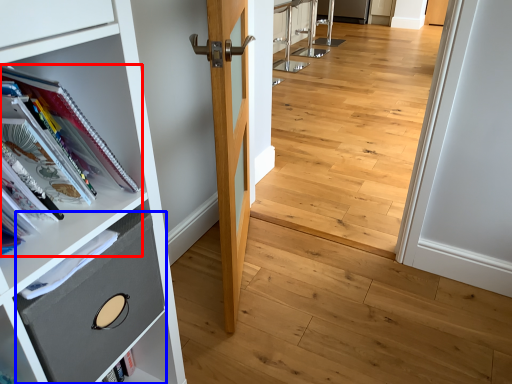
Question: Which object appears closest to the camera in this image, book (highlighted by a red box) or drawer (highlighted by a blue box)?

Choices:
 (A) book
 (B) drawer

Answer: (A)